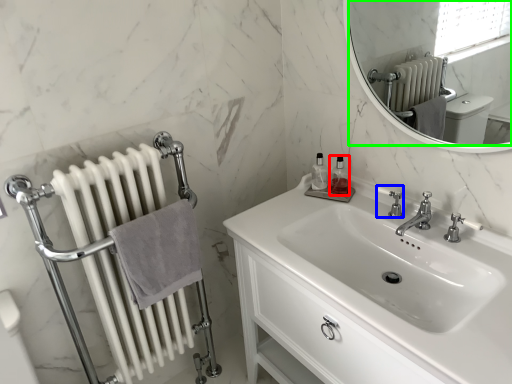
Question: Which object is positioned closest to toiletry (highlighted by a red box)? Select from plumbing fixture (highlighted by a blue box) and mirror (highlighted by a green box).

Choices:
 (A) plumbing fixture
 (B) mirror

Answer: (A)